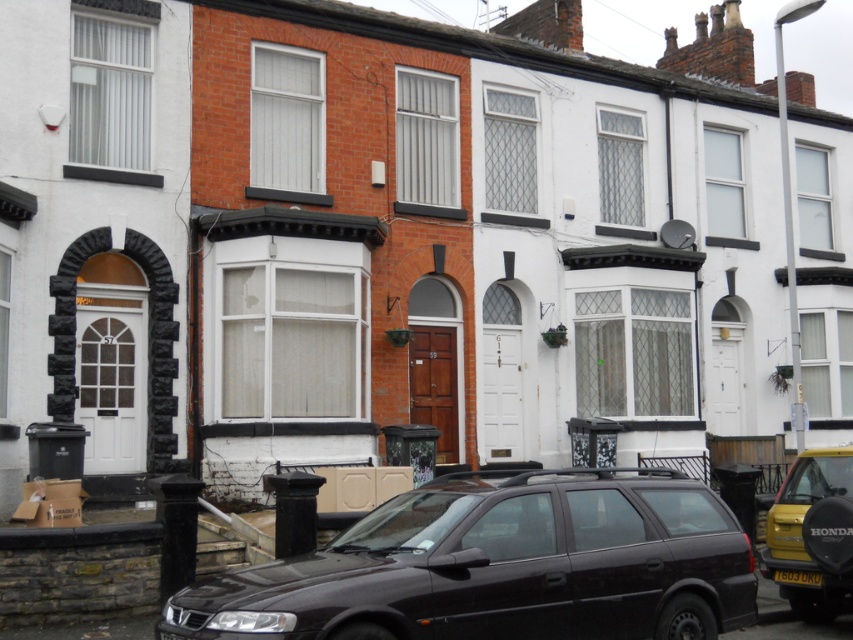
Does matte black car at center have a greater height compared to yellow matte van at lower right?

In fact, matte black car at center may be shorter than yellow matte van at lower right.

Between matte black car at center and yellow matte van at lower right, which one is positioned higher?

matte black car at center

Image resolution: width=853 pixels, height=640 pixels. Describe the element at coordinates (498, 566) in the screenshot. I see `matte black car at center` at that location.

Find the location of a particular element. This screenshot has width=853, height=640. matte black car at center is located at coordinates (498, 566).

This screenshot has height=640, width=853. Identify the location of yellow matte van at lower right. (801, 532).

Is point (809, 593) positioned behind point (782, 572)?

Yes, point (809, 593) is behind point (782, 572).

Find the location of `yellow matte van at lower right`. yellow matte van at lower right is located at coordinates (801, 532).

Is point (329, 566) more distant than point (817, 577)?

That is False.

Between point (341, 592) and point (804, 582), which one is positioned behind?

Positioned behind is point (804, 582).

Locate an element on the screen. This screenshot has height=640, width=853. matte black car at center is located at coordinates (498, 566).